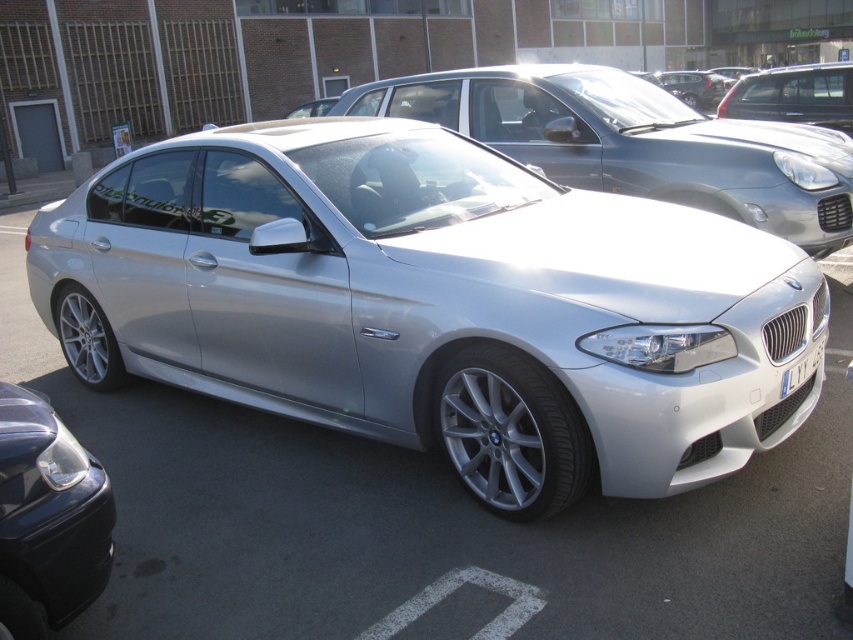
You are standing in front of the silver BMW sedan in the parking lot. You notice two points marked on the car. The first point is at coordinate (527, 145) and the second is at (32, 449). Which point is closer to you?

Point (527, 145) is further to the viewer than point (32, 449). Therefore, the point closer to you is point (32, 449).